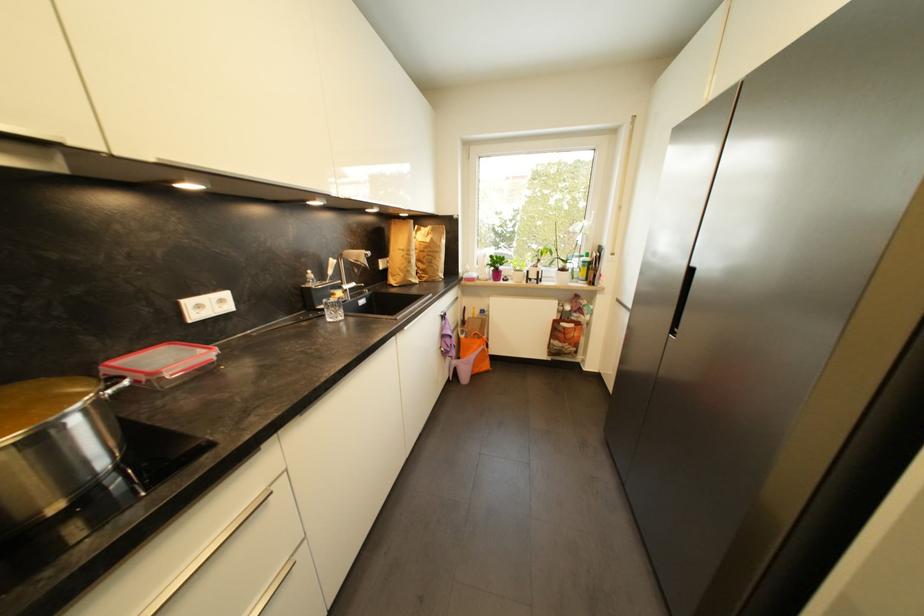
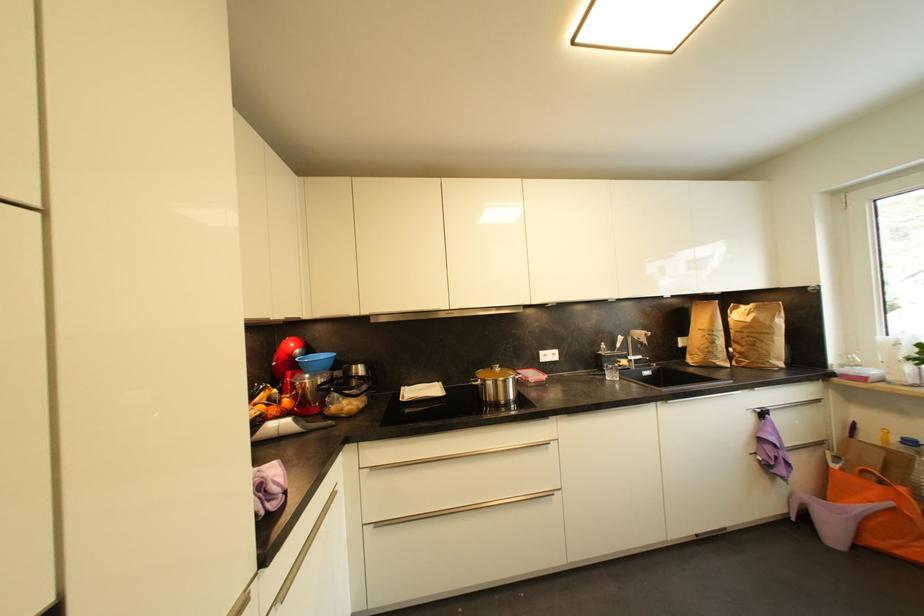
Find the pixel in the second image that matches [430,249] in the first image.

(748, 330)